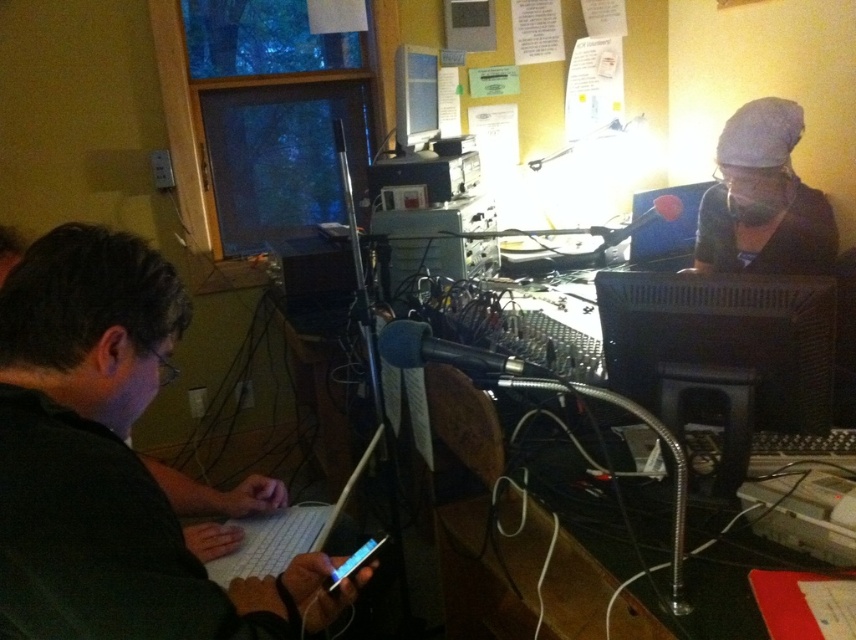
Question: Does white fabric cap at upper right have a smaller size compared to white plastic laptop at lower center?

Choices:
 (A) no
 (B) yes

Answer: (A)

Question: Considering the relative positions of black matte laptop at left and white fabric cap at upper right in the image provided, where is black matte laptop at left located with respect to white fabric cap at upper right?

Choices:
 (A) right
 (B) left

Answer: (B)

Question: Which of the following is the farthest from the observer?

Choices:
 (A) (764, 145)
 (B) (431, 52)
 (C) (211, 573)
 (D) (34, 616)

Answer: (B)

Question: Which object is closer to the camera taking this photo?

Choices:
 (A) white fabric cap at upper right
 (B) matte black monitor at upper center
 (C) black matte laptop at left

Answer: (C)

Question: Is white fabric cap at upper right smaller than white plastic laptop at lower center?

Choices:
 (A) yes
 (B) no

Answer: (B)

Question: Estimate the real-world distances between objects in this image. Which object is closer to the white plastic laptop at lower center?

Choices:
 (A) white fabric cap at upper right
 (B) matte black monitor at upper center

Answer: (A)